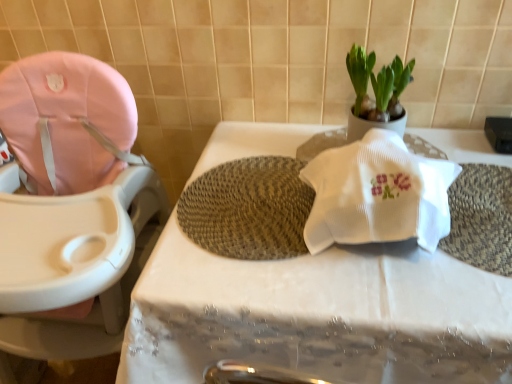
The height and width of the screenshot is (384, 512). Find the location of `free point above white fabric table at center (from a real-world perspective)`. free point above white fabric table at center (from a real-world perspective) is located at coordinates (372, 251).